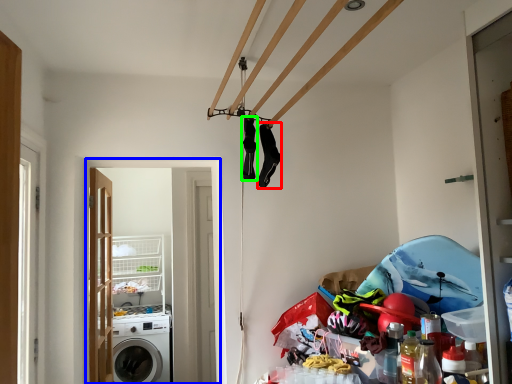
Question: Which object is positioned farthest from clothing (highlighted by a red box)? Select from screen door (highlighted by a blue box) and clothing (highlighted by a green box).

Choices:
 (A) screen door
 (B) clothing

Answer: (A)